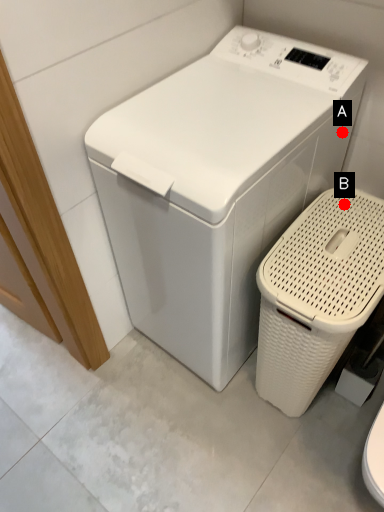
Question: Two points are circled on the image, labeled by A and B beside each circle. Which point is farther to the camera?

Choices:
 (A) A is further
 (B) B is further

Answer: (A)